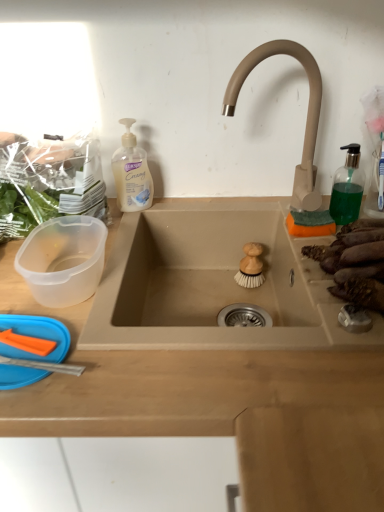
I want to click on unoccupied region to the right of white creamy liquid soap at upper left, so click(x=198, y=205).